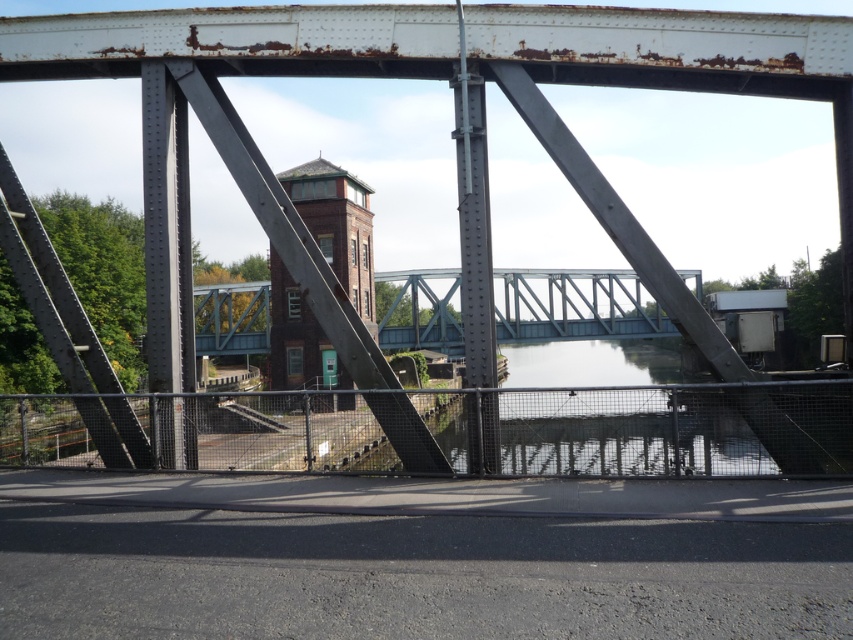
You are standing on the metal truss bridge and want to know how far the point at coordinates (473, 228) is from your current position. Can you determine the distance?

The point at coordinates (473, 228) is 10.87 meters away from the camera, so the distance from your current position on the bridge to that point is approximately 10.87 meters.

You are standing on the rusty metal train bridge at center and want to see the metallic gray bridge at center. Which bridge is taller from your perspective?

The metallic gray bridge at center is taller than the rusty metal train bridge at center, so the metallic gray bridge at center appears taller from your perspective.

You are standing on a platform and want to cross to the brick building across the river. The rusty metal train bridge at center is the only path. Given that the bridge is 9.79 meters away from you, can you safely walk to the brick building without any equipment?

The rusty metal train bridge at center is 9.79 meters away from viewer, so yes, you can safely walk to the brick building across the river as the distance is manageable without needing special equipment.